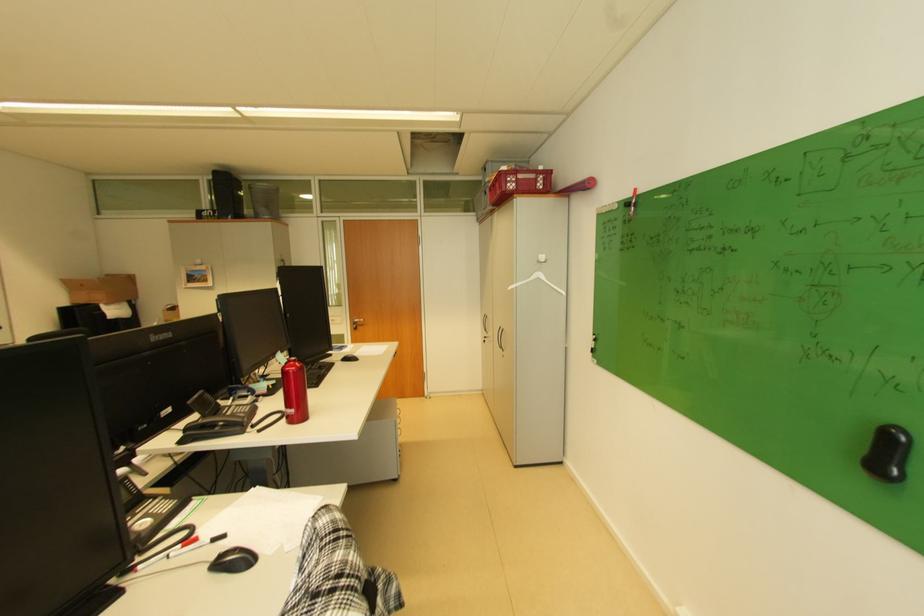
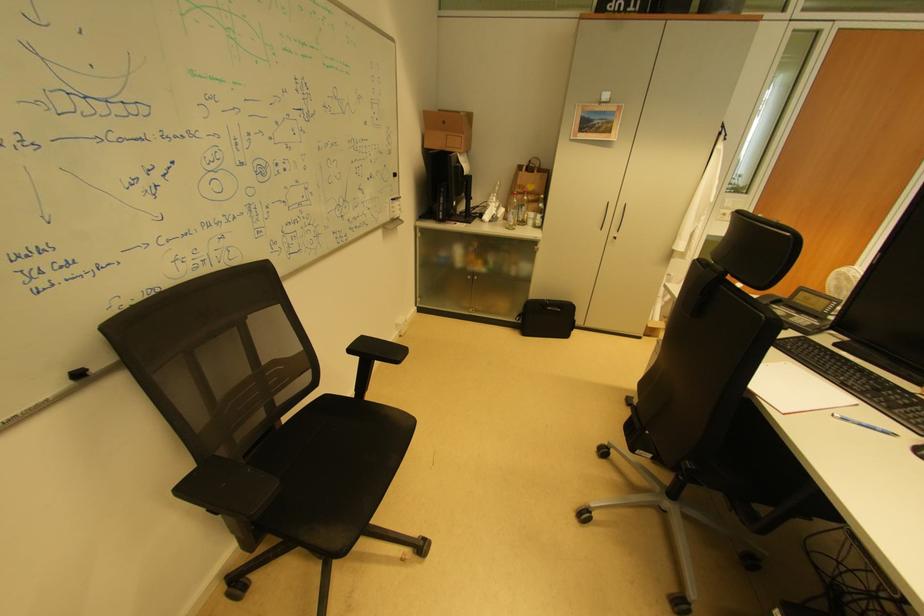
The point at (91, 286) is marked in the first image. Where is the corresponding point in the second image?

(453, 124)